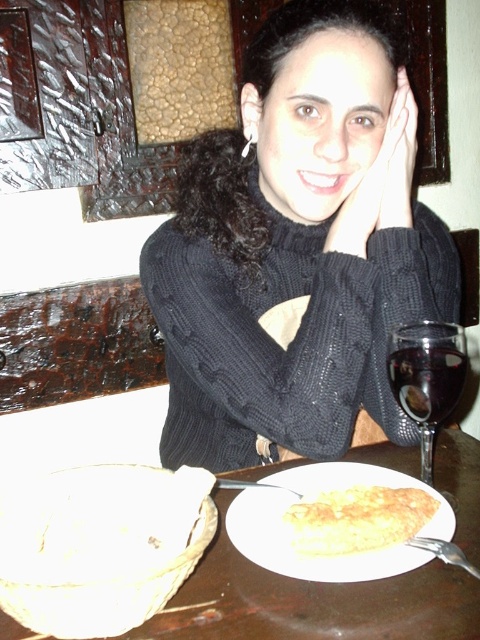
Is wooden table at center to the right of transparent glass wine at right from the viewer's perspective?

No, wooden table at center is not to the right of transparent glass wine at right.

Between wooden table at center and transparent glass wine at right, which one appears on the right side from the viewer's perspective?

transparent glass wine at right

What are the coordinates of `wooden table at center` in the screenshot? It's located at (312, 602).

This screenshot has height=640, width=480. Find the location of `wooden table at center`. wooden table at center is located at coordinates (312, 602).

Between black knitted sweater at center and transparent glass wine at right, which one has less height?

With less height is transparent glass wine at right.

Is point (333, 364) less distant than point (464, 344)?

No, it is behind (464, 344).

In order to click on black knitted sweater at center in this screenshot , I will do `click(298, 248)`.

Is black knitted sweater at center below yellowish matte omelette at center?

No.

The width and height of the screenshot is (480, 640). I want to click on black knitted sweater at center, so click(298, 248).